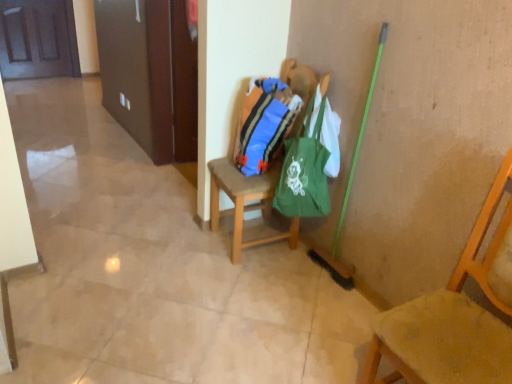
Question: Considering the relative sizes of wooden chair at right, which is counted as the 1th chair, starting from the front, and green canvas tote at center in the image provided, is wooden chair at right, which is counted as the 1th chair, starting from the front, smaller than green canvas tote at center?

Choices:
 (A) yes
 (B) no

Answer: (B)

Question: Considering the relative sizes of wooden chair at right, which appears as the second chair when viewed from the back, and green canvas tote at center in the image provided, is wooden chair at right, which appears as the second chair when viewed from the back, shorter than green canvas tote at center?

Choices:
 (A) no
 (B) yes

Answer: (A)

Question: From the image's perspective, is wooden chair at right, which appears as the second chair when viewed from the back, beneath green canvas tote at center?

Choices:
 (A) yes
 (B) no

Answer: (A)

Question: Does wooden chair at right, which appears as the second chair when viewed from the back, have a larger size compared to green canvas tote at center?

Choices:
 (A) no
 (B) yes

Answer: (B)

Question: Is wooden chair at right, which is counted as the 1th chair, starting from the front, to the left of green canvas tote at center from the viewer's perspective?

Choices:
 (A) yes
 (B) no

Answer: (B)

Question: Is wooden chair at right, acting as the 1th chair starting from the right, to the left or to the right of wooden door at upper left in the image?

Choices:
 (A) right
 (B) left

Answer: (A)

Question: In the image, is wooden chair at right, which appears as the second chair when viewed from the back, positioned in front of or behind wooden door at upper left?

Choices:
 (A) front
 (B) behind

Answer: (A)

Question: Looking at their shapes, would you say wooden chair at right, the 2th chair viewed from the left, is wider or thinner than wooden door at upper left?

Choices:
 (A) wide
 (B) thin

Answer: (A)

Question: Is point (470, 354) closer or farther from the camera than point (14, 74)?

Choices:
 (A) closer
 (B) farther

Answer: (A)

Question: Considering the positions of wooden chair at right, acting as the 1th chair starting from the right, and green canvas tote at center in the image, is wooden chair at right, acting as the 1th chair starting from the right, wider or thinner than green canvas tote at center?

Choices:
 (A) thin
 (B) wide

Answer: (B)

Question: From the image's perspective, is wooden chair at right, acting as the 1th chair starting from the right, positioned above or below green canvas tote at center?

Choices:
 (A) above
 (B) below

Answer: (B)

Question: Is wooden chair at right, acting as the 1th chair starting from the right, to the left or to the right of green canvas tote at center in the image?

Choices:
 (A) left
 (B) right

Answer: (B)

Question: Considering the positions of wooden chair at right, which appears as the second chair when viewed from the back, and green canvas tote at center in the image, is wooden chair at right, which appears as the second chair when viewed from the back, taller or shorter than green canvas tote at center?

Choices:
 (A) tall
 (B) short

Answer: (A)

Question: Based on their positions, is wooden chair at center, positioned as the second chair in front-to-back order, located to the left or right of green canvas tote at center?

Choices:
 (A) right
 (B) left

Answer: (B)

Question: Based on their sizes in the image, would you say wooden chair at center, which is the first chair in left-to-right order, is bigger or smaller than green canvas tote at center?

Choices:
 (A) small
 (B) big

Answer: (B)